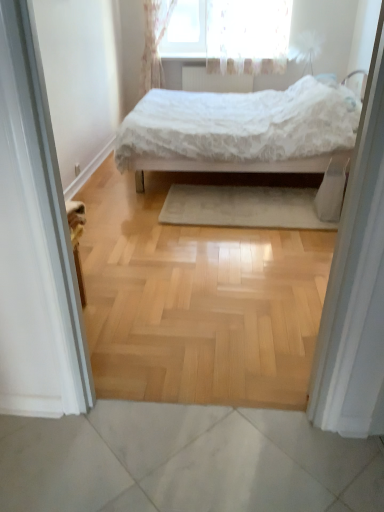
Question: Is beige soft rug at center in contact with white textured radiator at upper center?

Choices:
 (A) yes
 (B) no

Answer: (B)

Question: Is there a large distance between beige soft rug at center and white textured radiator at upper center?

Choices:
 (A) no
 (B) yes

Answer: (B)

Question: Can you confirm if beige soft rug at center is thinner than white textured radiator at upper center?

Choices:
 (A) yes
 (B) no

Answer: (B)

Question: Is beige soft rug at center to the left of white textured radiator at upper center from the viewer's perspective?

Choices:
 (A) no
 (B) yes

Answer: (A)

Question: From a real-world perspective, is beige soft rug at center physically above white textured radiator at upper center?

Choices:
 (A) no
 (B) yes

Answer: (A)

Question: From a real-world perspective, is beige soft rug at center located beneath white textured radiator at upper center?

Choices:
 (A) yes
 (B) no

Answer: (A)

Question: Is white lace bed at center aimed at white fabric screen door at right, positioned as the first screen door in right-to-left order?

Choices:
 (A) yes
 (B) no

Answer: (B)

Question: From a real-world perspective, does white lace bed at center sit lower than white fabric screen door at right, acting as the 2th screen door starting from the left?

Choices:
 (A) no
 (B) yes

Answer: (B)

Question: Can you confirm if white lace bed at center is shorter than white fabric screen door at right, acting as the 2th screen door starting from the left?

Choices:
 (A) no
 (B) yes

Answer: (B)

Question: Does white lace bed at center appear on the left side of white fabric screen door at right, acting as the 2th screen door starting from the left?

Choices:
 (A) no
 (B) yes

Answer: (B)

Question: Is white lace bed at center at the right side of white fabric screen door at right, positioned as the first screen door in right-to-left order?

Choices:
 (A) no
 (B) yes

Answer: (A)

Question: Does white lace bed at center have a lesser width compared to white fabric screen door at right, positioned as the first screen door in right-to-left order?

Choices:
 (A) yes
 (B) no

Answer: (B)

Question: Is white fabric screen door at right, acting as the 2th screen door starting from the left, not inside white lace curtain at upper center?

Choices:
 (A) no
 (B) yes

Answer: (B)